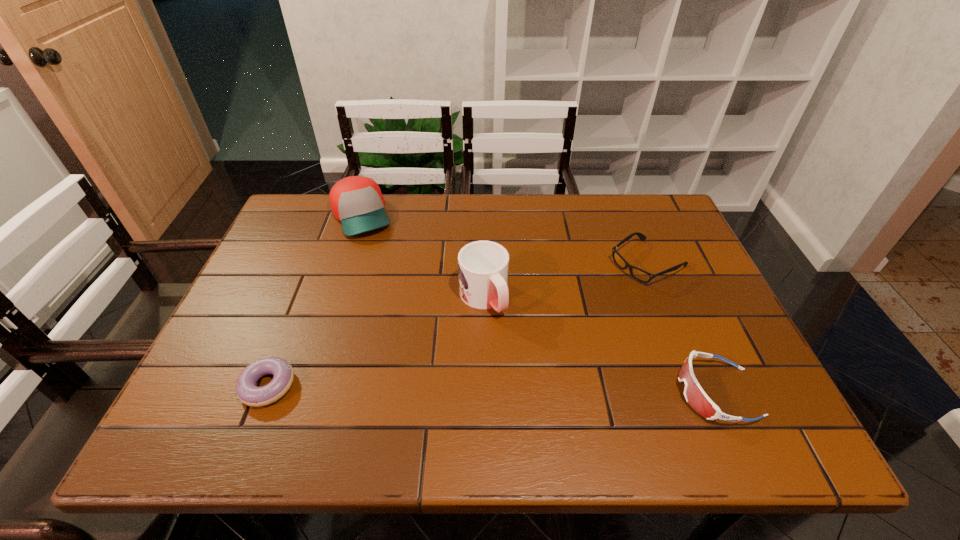
I want to click on doughnut, so click(247, 391).

I want to click on the third tallest object, so click(x=695, y=396).

Locate an element on the screen. The width and height of the screenshot is (960, 540). the second tallest object is located at coordinates (356, 201).

Locate an element on the screen. The image size is (960, 540). spectacles is located at coordinates pos(643,276).

Where is `the third object from left to right`? Image resolution: width=960 pixels, height=540 pixels. the third object from left to right is located at coordinates (483, 266).

Where is `mug`? mug is located at coordinates (483, 266).

Where is `vacant position located 0.310m on the right of the shortest object`? vacant position located 0.310m on the right of the shortest object is located at coordinates (444, 386).

Locate an element on the screen. Image resolution: width=960 pixels, height=540 pixels. free space located on the front-facing side of the third shortest object is located at coordinates (546, 392).

Where is `free space located on the front-facing side of the third shortest object`? This screenshot has width=960, height=540. free space located on the front-facing side of the third shortest object is located at coordinates (x=600, y=392).

This screenshot has height=540, width=960. I want to click on free space located on the front-facing side of the third shortest object, so click(635, 392).